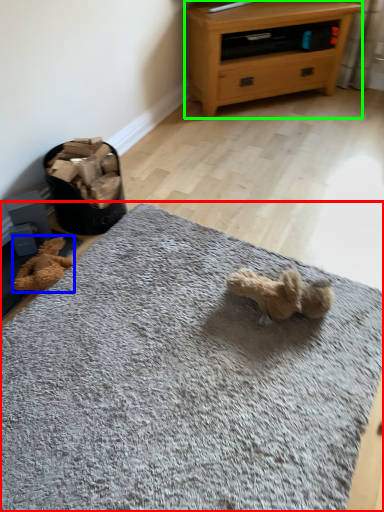
Question: Which object is the farthest from mat (highlighted by a red box)? Choose among these: teddy (highlighted by a blue box) or chest of drawers (highlighted by a green box).

Choices:
 (A) teddy
 (B) chest of drawers

Answer: (B)